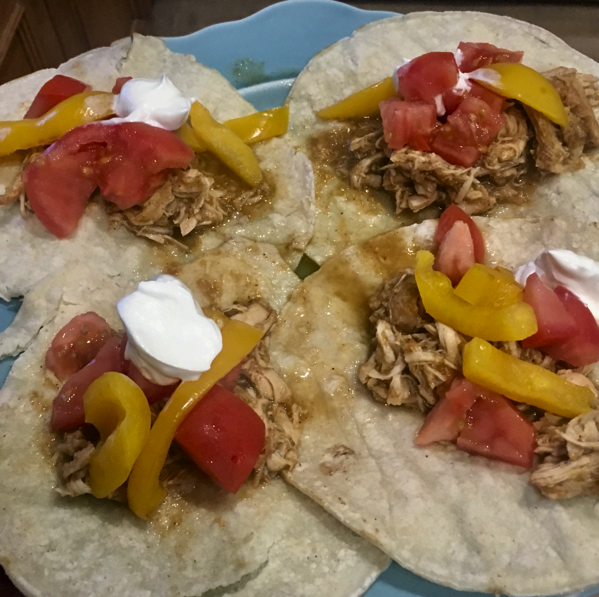
Locate an element on the screen. blue plate is located at coordinates (395, 578), (4, 307), (6, 365), (271, 85).